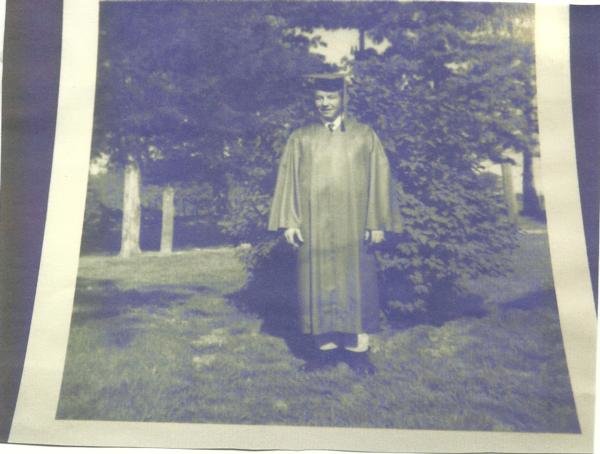
The height and width of the screenshot is (454, 600). Identify the location of tassle. (343, 99).